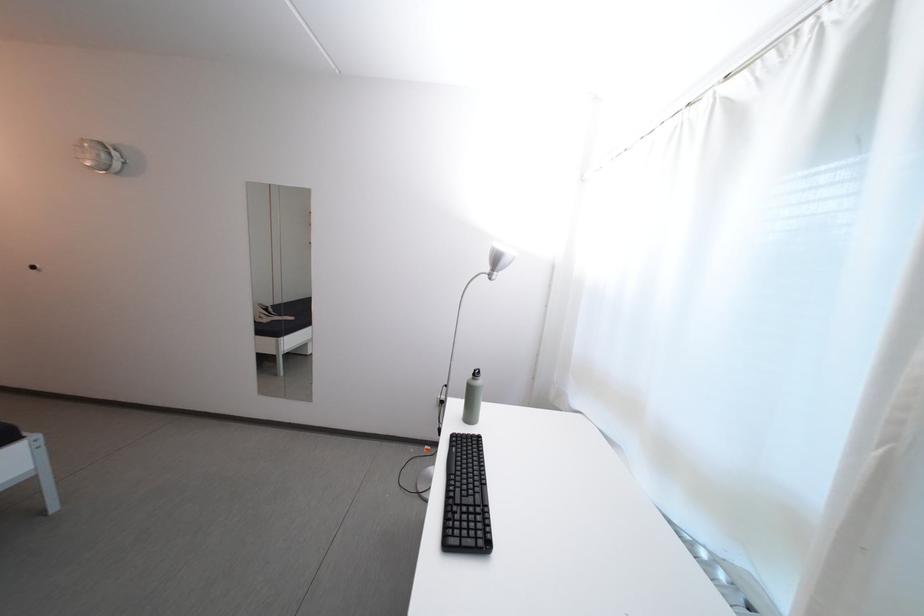
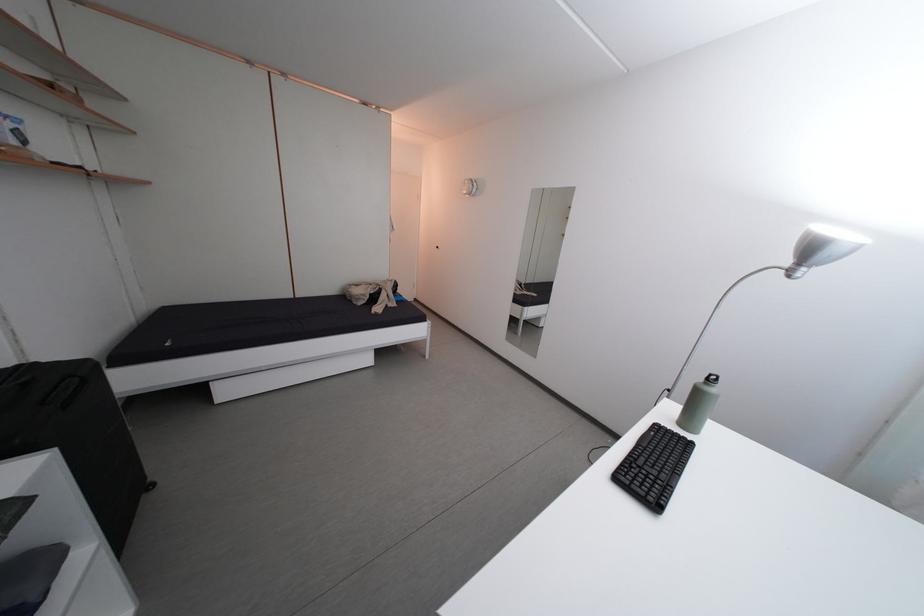
Find the pixel in the second image that matches (x=479, y=419) in the first image.

(699, 427)